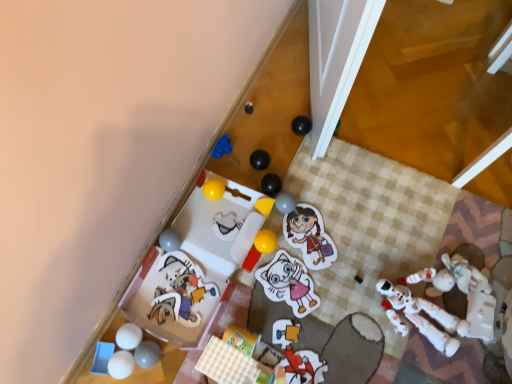
You are a GUI agent. You are given a task and a screenshot of the screen. Output one action in this format:
    pyautogui.click(x=<x>, y=<y>)
    Task: Click on the unoccupied space behind white plastic toy at lower right, marked as the first toy in a right-to-left arrangement
    The image size is (512, 384).
    Given the screenshot: What is the action you would take?
    pyautogui.click(x=411, y=233)